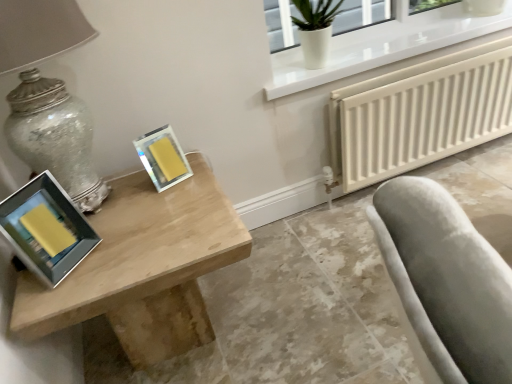
You are a GUI agent. You are given a task and a screenshot of the screen. Output one action in this format:
    pyautogui.click(x=<x>, y=<y>)
    Task: Click on the vacant space to the right of matte yellow picture frame at left, positioned as the 2th picture frame in back-to-front order
    
    Given the screenshot: What is the action you would take?
    pyautogui.click(x=124, y=244)